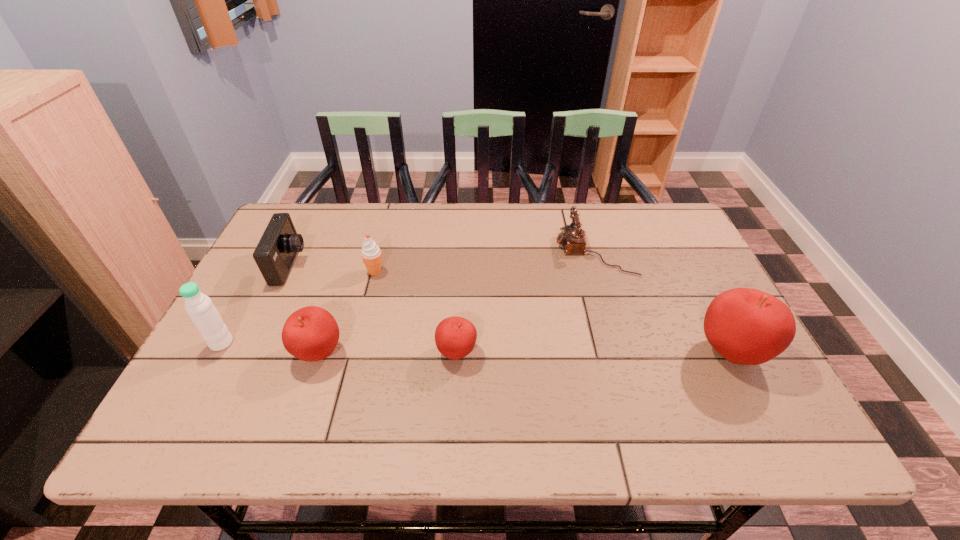
The width and height of the screenshot is (960, 540). Find the location of `object that stands as the fourth closest to the icecream`. object that stands as the fourth closest to the icecream is located at coordinates (204, 315).

Point out which object is positioned as the fifth nearest to the sixth object from right to left. Please provide its 2D coordinates. Your answer should be formatted as a tuple, i.e. [(x, y)], where the tuple contains the x and y coordinates of a point satisfying the conditions above.

[(572, 239)]

Select which apple appears as the third closest to the sixth object from right to left. Please provide its 2D coordinates. Your answer should be formatted as a tuple, i.e. [(x, y)], where the tuple contains the x and y coordinates of a point satisfying the conditions above.

[(746, 326)]

Select which apple is the third closest to the icecream. Please provide its 2D coordinates. Your answer should be formatted as a tuple, i.e. [(x, y)], where the tuple contains the x and y coordinates of a point satisfying the conditions above.

[(746, 326)]

Where is `blank area in the image that satisfies the following two spatial constraints: 1. on the front-facing side of the sixth object from right to left; 2. on the left side of the second shortest apple`? The width and height of the screenshot is (960, 540). blank area in the image that satisfies the following two spatial constraints: 1. on the front-facing side of the sixth object from right to left; 2. on the left side of the second shortest apple is located at coordinates (249, 353).

Locate an element on the screen. The width and height of the screenshot is (960, 540). free space that satisfies the following two spatial constraints: 1. on the dial of the telephone; 2. on the front side of the shortest apple is located at coordinates (625, 353).

Image resolution: width=960 pixels, height=540 pixels. Find the location of `vacant space that satisfies the following two spatial constraints: 1. on the front-facing side of the rightmost object; 2. on the left side of the second object from left to right`. vacant space that satisfies the following two spatial constraints: 1. on the front-facing side of the rightmost object; 2. on the left side of the second object from left to right is located at coordinates (250, 352).

You are a GUI agent. You are given a task and a screenshot of the screen. Output one action in this format:
    pyautogui.click(x=<x>, y=<y>)
    Task: Click on the vacant region that satisfies the following two spatial constraints: 1. on the front-facing side of the second object from left to right; 2. on the left side of the rightmost apple
    The image size is (960, 540).
    Given the screenshot: What is the action you would take?
    pyautogui.click(x=250, y=352)

Locate an element on the screen. This screenshot has height=540, width=960. free region that satisfies the following two spatial constraints: 1. on the front side of the tallest apple; 2. on the right side of the leftmost object is located at coordinates (217, 352).

The image size is (960, 540). I want to click on free spot that satisfies the following two spatial constraints: 1. on the front-facing side of the icecream; 2. on the left side of the camera, so click(x=287, y=272).